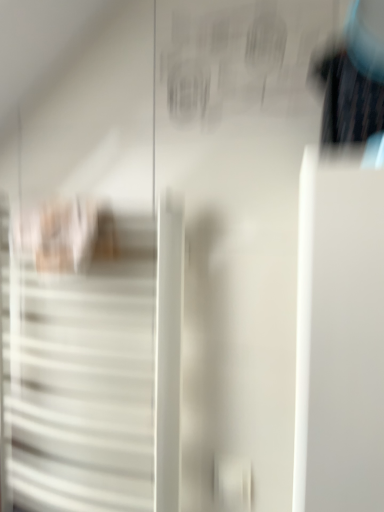
This screenshot has width=384, height=512. In order to click on white matte door at left in this screenshot , I will do [x=82, y=280].

The width and height of the screenshot is (384, 512). What do you see at coordinates (82, 280) in the screenshot?
I see `white matte door at left` at bounding box center [82, 280].

Find the location of `black glossy hairbrush at upper right`. black glossy hairbrush at upper right is located at coordinates (355, 78).

The image size is (384, 512). Describe the element at coordinates (355, 78) in the screenshot. I see `black glossy hairbrush at upper right` at that location.

At what (x,y) coordinates should I click in order to perform the action: click on white matte door at left. Please return your answer as a coordinate pair (x, y). The image size is (384, 512). Looking at the image, I should click on (82, 280).

Is white matte door at left at the right side of black glossy hairbrush at upper right?

Incorrect, white matte door at left is not on the right side of black glossy hairbrush at upper right.

Is the position of white matte door at left more distant than that of black glossy hairbrush at upper right?

Yes, it is.

Is point (135, 130) closer or farther from the camera than point (380, 104)?

Point (135, 130) appears to be farther away from the viewer than point (380, 104).

From the image's perspective, is white matte door at left below black glossy hairbrush at upper right?

Yes.

From a real-world perspective, is white matte door at left physically below black glossy hairbrush at upper right?

Correct, in the physical world, white matte door at left is lower than black glossy hairbrush at upper right.

Considering the sizes of objects white matte door at left and black glossy hairbrush at upper right in the image provided, who is wider, white matte door at left or black glossy hairbrush at upper right?

Wider between the two is black glossy hairbrush at upper right.

Considering the relative sizes of white matte door at left and black glossy hairbrush at upper right in the image provided, is white matte door at left taller than black glossy hairbrush at upper right?

Yes, white matte door at left is taller than black glossy hairbrush at upper right.

Who is bigger, white matte door at left or black glossy hairbrush at upper right?

white matte door at left is bigger.

From the picture: Is white matte door at left spatially inside black glossy hairbrush at upper right, or outside of it?

white matte door at left cannot be found inside black glossy hairbrush at upper right.

Are white matte door at left and black glossy hairbrush at upper right beside each other?

No, white matte door at left is not in contact with black glossy hairbrush at upper right.

Is black glossy hairbrush at upper right at the back of white matte door at left?

No, white matte door at left is not facing the opposite direction of black glossy hairbrush at upper right.

Can you tell me how much white matte door at left and black glossy hairbrush at upper right differ in facing direction?

The facing directions of white matte door at left and black glossy hairbrush at upper right are 0.000392 degrees apart.

Identify the location of door directly beneath the black glossy hairbrush at upper right (from a real-world perspective). The height and width of the screenshot is (512, 384). (82, 280).

Between black glossy hairbrush at upper right and white matte door at left, which one appears on the left side from the viewer's perspective?

From the viewer's perspective, white matte door at left appears more on the left side.

Considering their positions, is black glossy hairbrush at upper right located in front of or behind white matte door at left?

In the image, black glossy hairbrush at upper right appears in front of white matte door at left.

Is point (353, 96) farther from camera compared to point (66, 226)?

No, it is in front of (66, 226).

From the image's perspective, is black glossy hairbrush at upper right located above white matte door at left?

Yes, from the image's perspective, black glossy hairbrush at upper right is above white matte door at left.

From a real-world perspective, who is located lower, black glossy hairbrush at upper right or white matte door at left?

white matte door at left.

Which object is wider, black glossy hairbrush at upper right or white matte door at left?

black glossy hairbrush at upper right is wider.

Does black glossy hairbrush at upper right have a greater height compared to white matte door at left?

No, black glossy hairbrush at upper right is not taller than white matte door at left.

Is black glossy hairbrush at upper right bigger or smaller than white matte door at left?

Considering their sizes, black glossy hairbrush at upper right takes up less space than white matte door at left.

Is white matte door at left surrounded by black glossy hairbrush at upper right?

No, white matte door at left is not surrounded by black glossy hairbrush at upper right.

Are black glossy hairbrush at upper right and white matte door at left far apart?

No.

Consider the image. Is black glossy hairbrush at upper right oriented towards white matte door at left?

No, black glossy hairbrush at upper right is not aimed at white matte door at left.

Locate an element on the screen. The width and height of the screenshot is (384, 512). door behind the black glossy hairbrush at upper right is located at coordinates (82, 280).

Identify the location of couple positioned vertically above the white matte door at left (from a real-world perspective). This screenshot has width=384, height=512. (355, 78).

Identify the location of door on the left of the black glossy hairbrush at upper right. The image size is (384, 512). point(82,280).